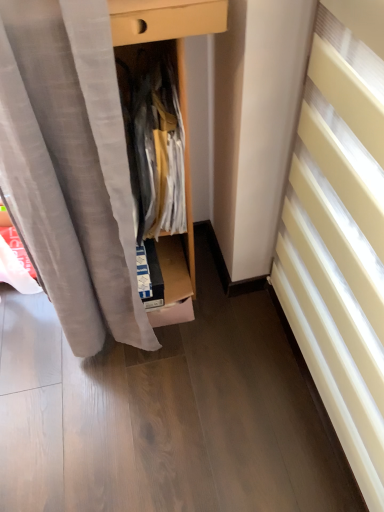
Question: Considering the relative sizes of white textured radiator at right and white cotton shirt at center in the image provided, is white textured radiator at right wider than white cotton shirt at center?

Choices:
 (A) yes
 (B) no

Answer: (A)

Question: Is white textured radiator at right turned away from white cotton shirt at center?

Choices:
 (A) yes
 (B) no

Answer: (B)

Question: From a real-world perspective, is white textured radiator at right on white cotton shirt at center?

Choices:
 (A) no
 (B) yes

Answer: (A)

Question: Can you confirm if white textured radiator at right is shorter than white cotton shirt at center?

Choices:
 (A) no
 (B) yes

Answer: (A)

Question: From the image's perspective, would you say white textured radiator at right is shown under white cotton shirt at center?

Choices:
 (A) no
 (B) yes

Answer: (B)

Question: Can you confirm if white textured radiator at right is positioned to the right of white cotton shirt at center?

Choices:
 (A) no
 (B) yes

Answer: (B)

Question: Can you confirm if white cotton shirt at center is positioned to the right of white textured radiator at right?

Choices:
 (A) yes
 (B) no

Answer: (B)

Question: From a real-world perspective, is white cotton shirt at center under white textured radiator at right?

Choices:
 (A) yes
 (B) no

Answer: (B)

Question: Is white cotton shirt at center thinner than white textured radiator at right?

Choices:
 (A) yes
 (B) no

Answer: (A)

Question: From a real-world perspective, does white cotton shirt at center stand above white textured radiator at right?

Choices:
 (A) no
 (B) yes

Answer: (B)

Question: Can you confirm if white cotton shirt at center is shorter than white textured radiator at right?

Choices:
 (A) no
 (B) yes

Answer: (B)

Question: Is the position of white cotton shirt at center more distant than that of white textured radiator at right?

Choices:
 (A) no
 (B) yes

Answer: (B)

Question: From a real-world perspective, relative to white textured radiator at right, is white cotton shirt at center vertically above or below?

Choices:
 (A) below
 (B) above

Answer: (B)